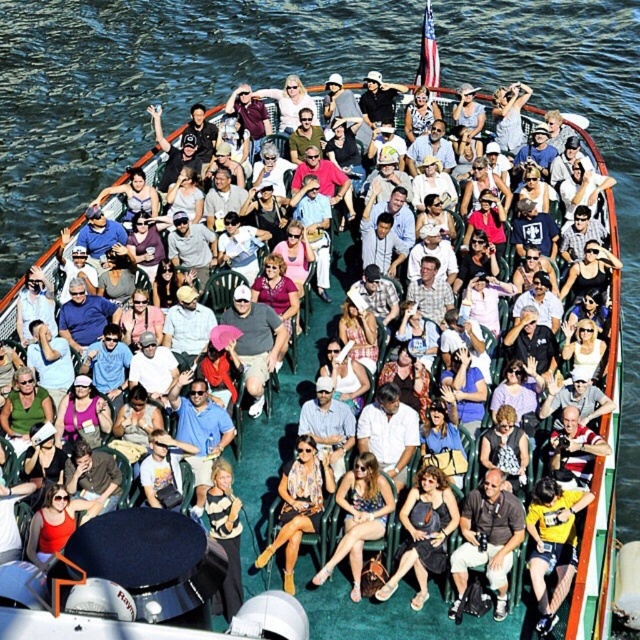
Question: Can you confirm if matte black camera at center is positioned to the right of leather jacket at center?

Choices:
 (A) no
 (B) yes

Answer: (B)

Question: Which is farther from the leather jacket at center?

Choices:
 (A) yellow t-shirt at lower right
 (B) patterned fabric dress at center

Answer: (A)

Question: Is yellow t-shirt at lower right below patterned fabric dress at center?

Choices:
 (A) yes
 (B) no

Answer: (A)

Question: Which of the following is the closest to the observer?

Choices:
 (A) matte black dress at center
 (B) leather jacket at center

Answer: (A)

Question: Which object is farther from the camera taking this photo?

Choices:
 (A) matte black camera at center
 (B) striped sweater at center
 (C) yellow t-shirt at lower right
 (D) matte black dress at center

Answer: (D)

Question: Is yellow t-shirt at lower right closer to the viewer compared to matte black dress at center?

Choices:
 (A) yes
 (B) no

Answer: (A)